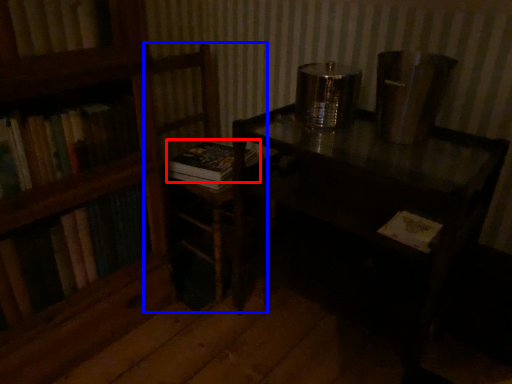
Question: Which object appears closest to the camera in this image, book (highlighted by a red box) or armchair (highlighted by a blue box)?

Choices:
 (A) book
 (B) armchair

Answer: (B)